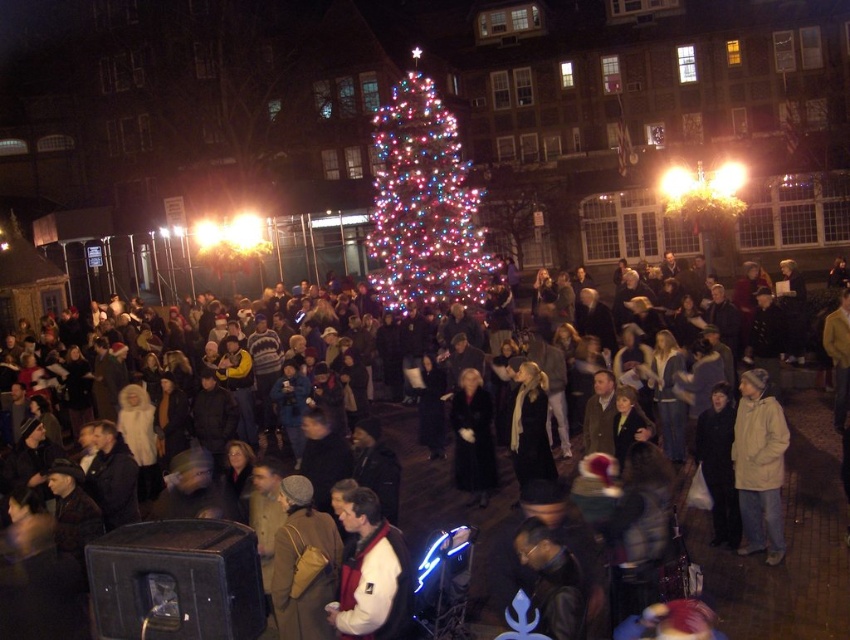
You are standing in the town square and see the illuminated plastic christmas tree at center and the white matte coat at center. Which object is located to the right of the other?

The white matte coat at center is located to the right of the illuminated plastic christmas tree at center because the tree is on the left side of the coat.

Based on the photo, you are a photographer positioned at the edge of the square and want to capture both the illuminated plastic christmas tree at center and the white fleece jacket at center in a single shot. Which object is wider so that you can adjust your camera angle accordingly?

The illuminated plastic christmas tree at center is wider than the white fleece jacket at center, so you should adjust your camera angle to ensure the tree is fully captured in the frame.

You are a photographer standing in the town square and want to take a photo of both the illuminated plastic christmas tree at center and the white matte coat at center. Which object will appear closer to the camera in the photo?

The illuminated plastic christmas tree at center will appear closer to the camera because it is further to the viewer than the white matte coat at center, meaning it is positioned nearer to the photographer.